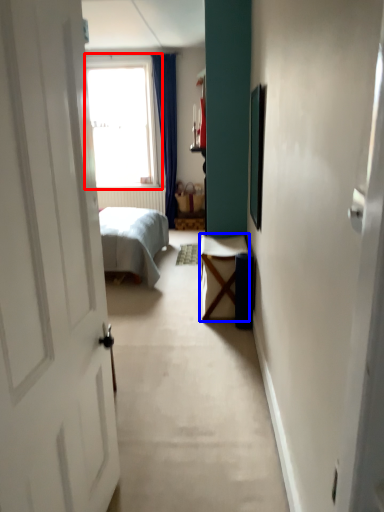
Question: Which object is further to the camera taking this photo, window (highlighted by a red box) or table (highlighted by a blue box)?

Choices:
 (A) window
 (B) table

Answer: (A)